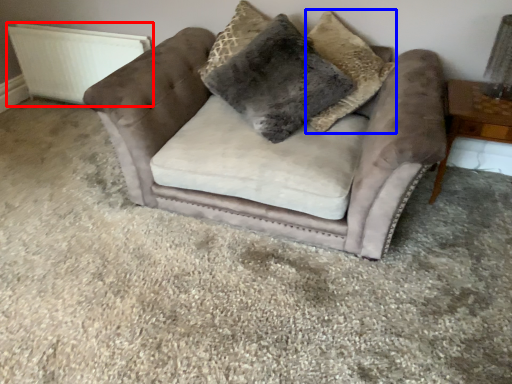
Question: Among these objects, which one is farthest to the camera, radiator (highlighted by a red box) or pillow (highlighted by a blue box)?

Choices:
 (A) radiator
 (B) pillow

Answer: (A)